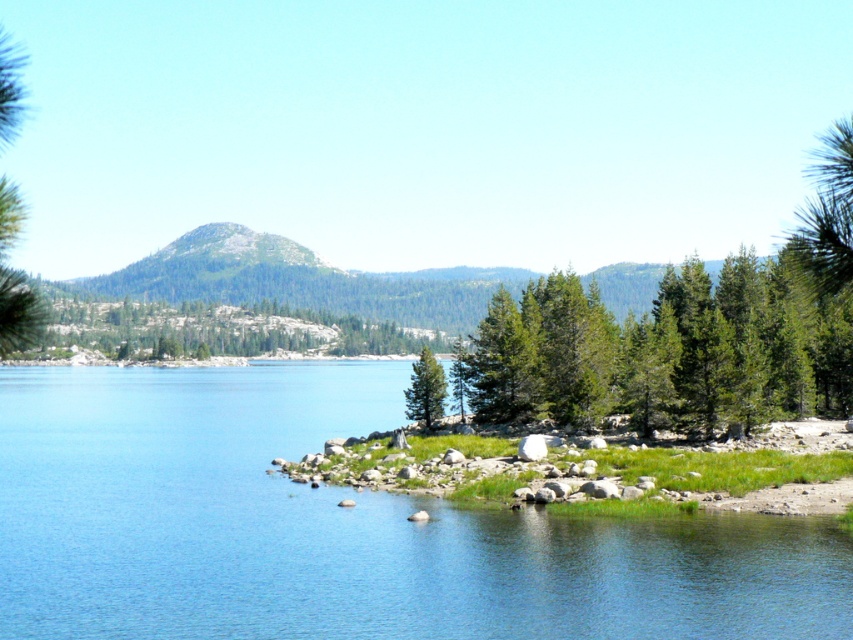
You are standing at the lakeside and want to cross to the other side. The clear blue water at lower center and the green textured tree at center are in your path. Which one is wider so you can choose the easier route?

The clear blue water at lower center is wider than the green textured tree at center, so you should choose the clear blue water at lower center for an easier crossing.

You are standing at the lakeside and want to take a photo that includes both the clear blue water at lower center and the green matte tree at center. Which object should you frame first to ensure both are visible in the photo?

You should frame the clear blue water at lower center first because it is larger in size than the green matte tree at center, allowing both to fit within the frame.

From the picture: You are standing at the lakeside and see two points marked on the image. The first point is at coordinates point (538, 552) and the second is at point (436, 403). Which point is closer to you?

Point (538, 552) is in front of point (436, 403), so the first point is closer to you.